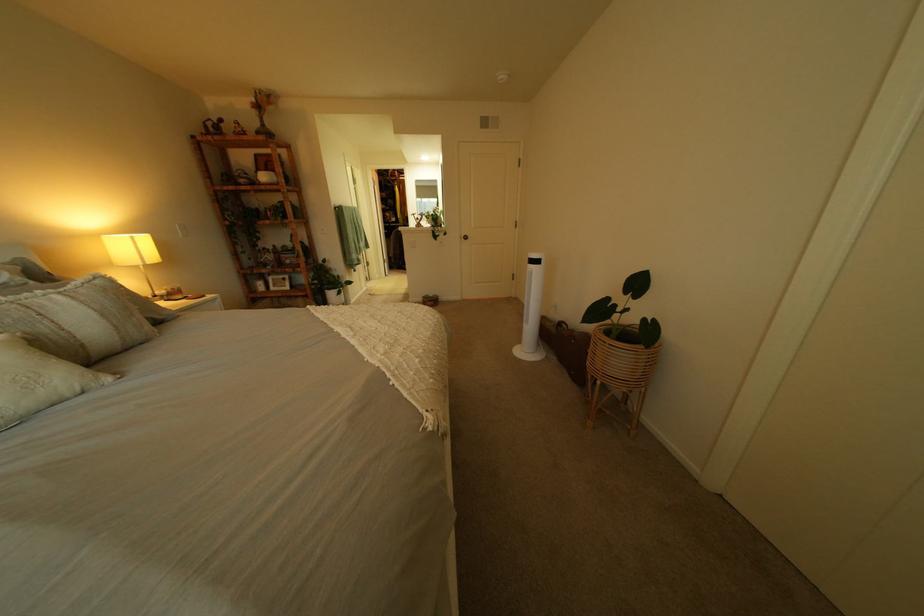
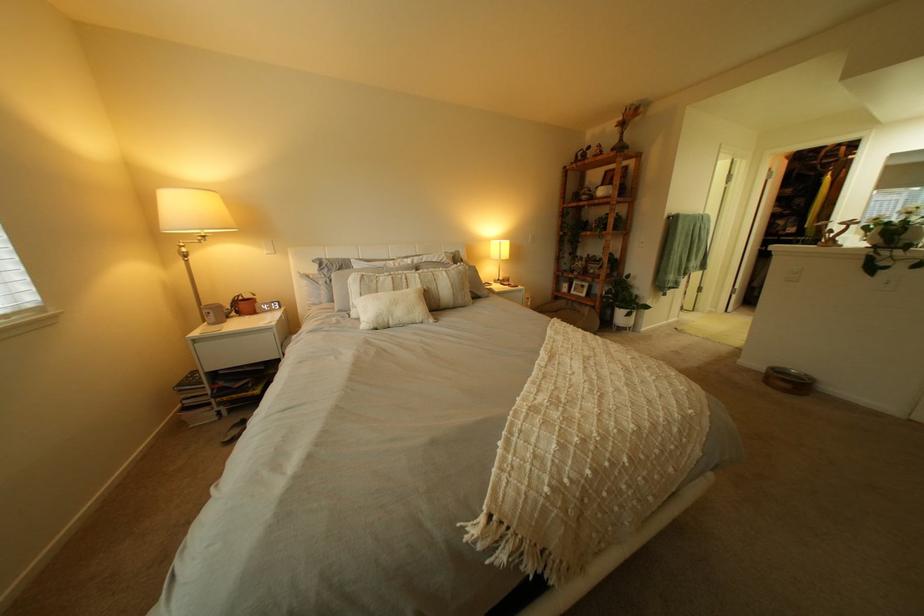
Find the pixel in the second image that matches (x=377, y=351) in the first image.

(541, 387)